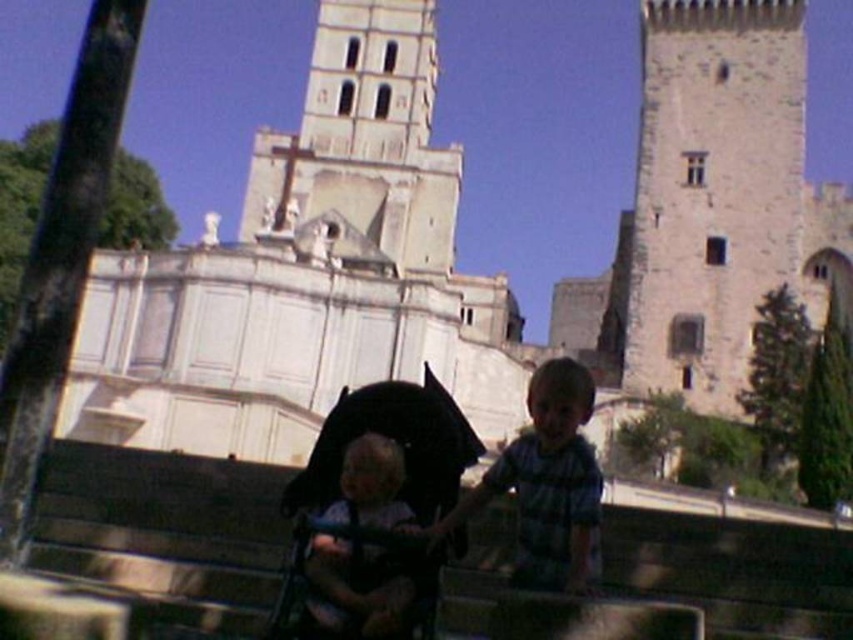
You are a photographer trying to capture both the black fabric baby carriage at center and the striped cotton shirt at center in the same frame. Since the baby carriage is blocking part of the shirt, how can you adjust your position to include both without moving any objects?

Move your position slightly behind the black fabric baby carriage at center so that it is no longer blocking the striped cotton shirt at center, allowing both to be visible in the frame.

You are a photographer trying to capture a photo of the black fabric baby carriage at center and the striped cotton shirt at center. Since you want to focus on the baby carriage, which object should you move closer to the camera to ensure it appears larger in the photo?

To make the black fabric baby carriage at center appear larger in the photo, you should move it closer to the camera. Since it is thinner than the striped cotton shirt at center, moving it forward will help it stand out more in the frame.

You are standing at the point labeled point (329,588) and want to walk to the point labeled point (561,467). According to the scene, which direction should you move to reach your destination?

To reach point (561,467) from point (329,588), you should move backward because point (561,467) is behind point (329,588).